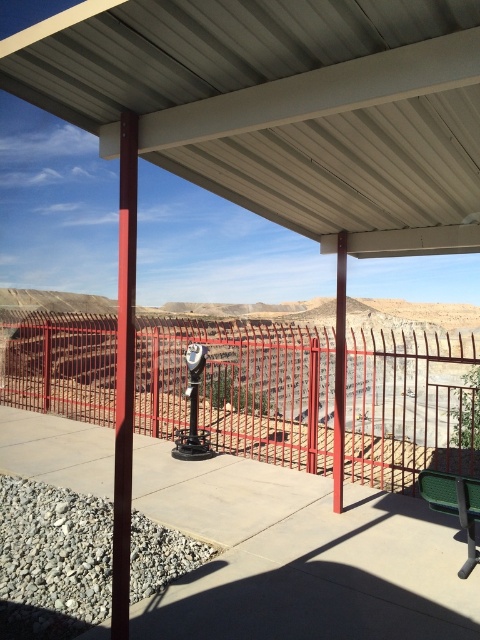
Looking at this image, you are a visitor standing at the green plastic bench at lower right and want to look through the telescope mounted on the black stand. To reach the telescope, you need to walk past the metallic gray canopy at upper center. Is the path clear between the bench and the telescope?

The metallic gray canopy at upper center is in front of the green plastic bench at lower right, so the path between the bench and the telescope might be blocked by the canopy. You may need to move around the canopy to reach the telescope.